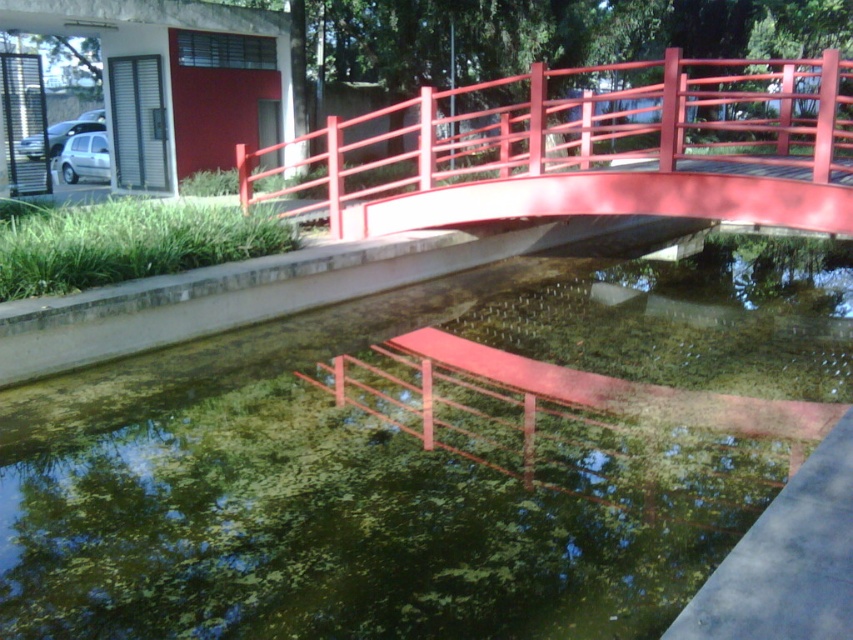
Who is taller, green algae-covered pond at center or glossy metal bridge at upper center?

With more height is glossy metal bridge at upper center.

Who is more forward, (563, 632) or (828, 145)?

Point (563, 632) is more forward.

Is point (148, 589) more distant than point (299, 182)?

No, (148, 589) is in front of (299, 182).

Identify the location of green algae-covered pond at center. (416, 464).

Does point (672, 586) lie behind point (196, 209)?

That is False.

Based on the photo, does green algae-covered pond at center have a greater height compared to green leafy algae at lower left?

Yes, green algae-covered pond at center is taller than green leafy algae at lower left.

Locate an element on the screen. Image resolution: width=853 pixels, height=640 pixels. green algae-covered pond at center is located at coordinates (416, 464).

Looking at this image, is glossy metal bridge at upper center smaller than green leafy algae at lower left?

Incorrect, glossy metal bridge at upper center is not smaller in size than green leafy algae at lower left.

Who is more forward, [717,108] or [166,259]?

Point [166,259] is more forward.

Where is `glossy metal bridge at upper center`? The image size is (853, 640). glossy metal bridge at upper center is located at coordinates (601, 150).